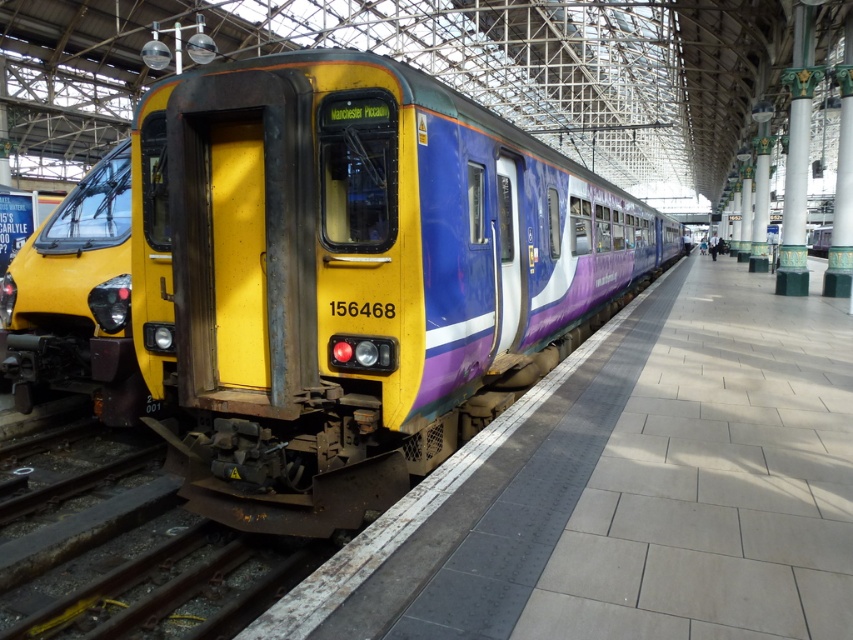
You are a station engineer inspecting the platform. You need to determine if there is enough space between the metal at center and the yellow matte train at left for a maintenance cart that is 2 meters wide. Can you confirm?

The metal at center occupies less space than yellow matte train at left, so the space between them is sufficient for the maintenance cart that is 2 meters wide.

You are standing on the platform and want to board the yellow matte train at left. There is a metal at center blocking your path. Can you walk around it to reach the train?

The metal at center is closer to the viewer than the yellow matte train at left, so you can walk around the metal at center to reach the yellow matte train at left.